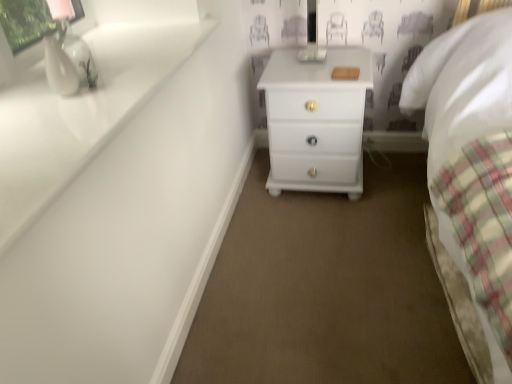
Identify the location of vacant space to the right of white glossy vase at upper left. The height and width of the screenshot is (384, 512). (124, 85).